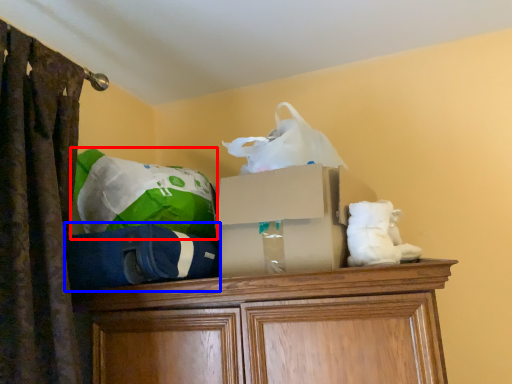
Question: Which object appears closest to the camera in this image, bean bag chair (highlighted by a red box) or bean bag chair (highlighted by a blue box)?

Choices:
 (A) bean bag chair
 (B) bean bag chair

Answer: (B)